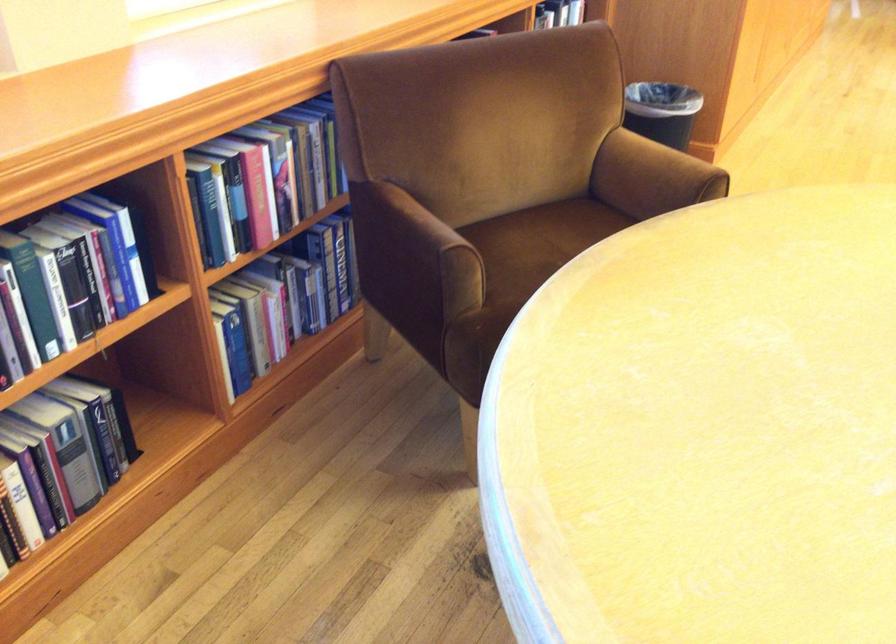
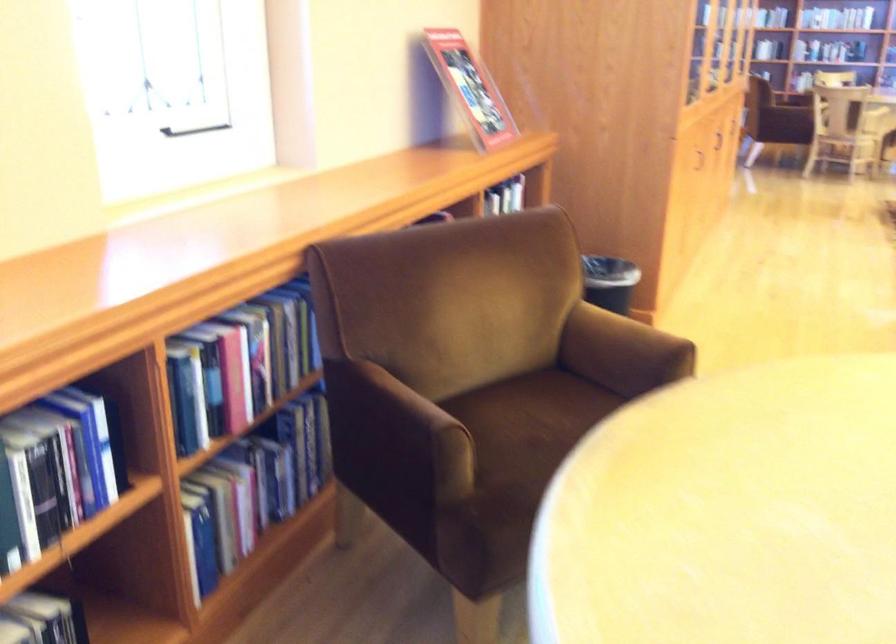
Where in the second image is the point corresponding to point 427,222 from the first image?

(414, 402)